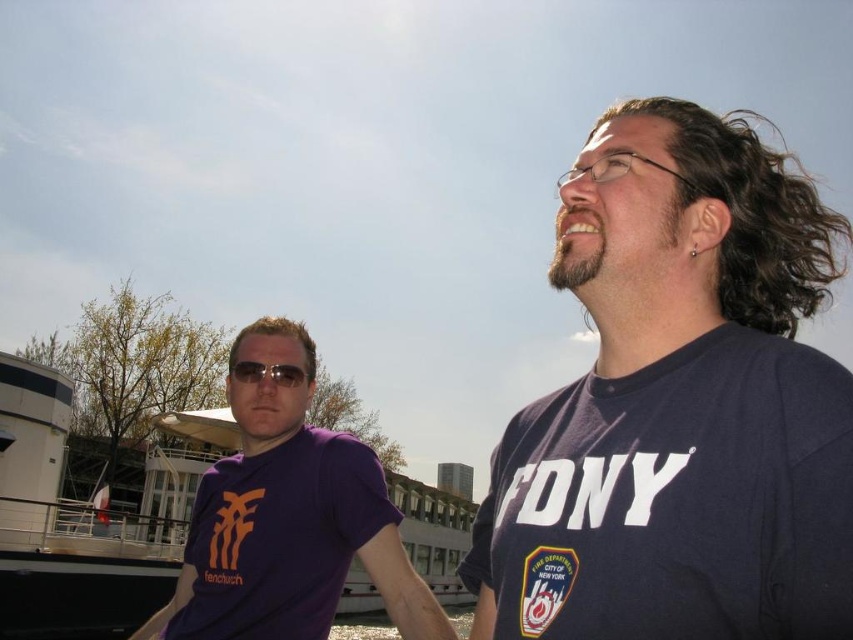
Question: Estimate the real-world distances between objects in this image. Which object is closer to the matte black sunglasses at center?

Choices:
 (A) purple matte t-shirt at left
 (B) dark blue t-shirt at upper right

Answer: (A)

Question: Is dark blue t-shirt at upper right positioned before purple matte t-shirt at center?

Choices:
 (A) no
 (B) yes

Answer: (B)

Question: Does dark blue t-shirt at upper right have a smaller size compared to matte black sunglasses at center?

Choices:
 (A) no
 (B) yes

Answer: (A)

Question: Which point is farther to the camera?

Choices:
 (A) (720, 602)
 (B) (381, 516)
 (C) (335, 600)

Answer: (B)

Question: Is dark blue t-shirt at upper right behind matte black sunglasses at center?

Choices:
 (A) yes
 (B) no

Answer: (B)

Question: Estimate the real-world distances between objects in this image. Which object is farther from the matte black sunglasses at center?

Choices:
 (A) purple matte t-shirt at left
 (B) purple matte t-shirt at center
 (C) dark blue t-shirt at upper right

Answer: (C)